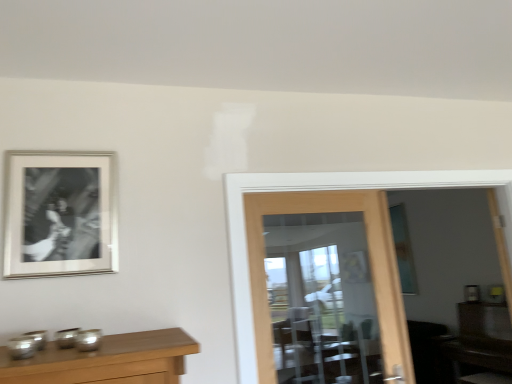
Question: Considering the relative positions of silver/metallic photo frame at upper left and clear glass door at center in the image provided, is silver/metallic photo frame at upper left to the right of clear glass door at center from the viewer's perspective?

Choices:
 (A) no
 (B) yes

Answer: (A)

Question: Is silver/metallic photo frame at upper left positioned beyond the bounds of clear glass door at center?

Choices:
 (A) no
 (B) yes

Answer: (B)

Question: Is silver/metallic photo frame at upper left to the left of clear glass door at center from the viewer's perspective?

Choices:
 (A) no
 (B) yes

Answer: (B)

Question: Does silver/metallic photo frame at upper left have a lesser width compared to clear glass door at center?

Choices:
 (A) no
 (B) yes

Answer: (B)

Question: Is silver/metallic photo frame at upper left bigger than clear glass door at center?

Choices:
 (A) yes
 (B) no

Answer: (B)

Question: Is brown wooden dresser at lower right spatially inside clear glass door at center, or outside of it?

Choices:
 (A) outside
 (B) inside

Answer: (A)

Question: In terms of height, does brown wooden dresser at lower right look taller or shorter compared to clear glass door at center?

Choices:
 (A) short
 (B) tall

Answer: (A)

Question: Considering their positions, is brown wooden dresser at lower right located in front of or behind clear glass door at center?

Choices:
 (A) behind
 (B) front

Answer: (A)

Question: In terms of size, does brown wooden dresser at lower right appear bigger or smaller than clear glass door at center?

Choices:
 (A) small
 (B) big

Answer: (B)

Question: Would you say clear glass door at center is to the left or to the right of brown wooden dresser at lower right in the picture?

Choices:
 (A) left
 (B) right

Answer: (A)

Question: Based on their sizes in the image, would you say clear glass door at center is bigger or smaller than brown wooden dresser at lower right?

Choices:
 (A) big
 (B) small

Answer: (B)

Question: Relative to brown wooden dresser at lower right, is clear glass door at center in front or behind?

Choices:
 (A) front
 (B) behind

Answer: (A)

Question: Is clear glass door at center taller or shorter than brown wooden dresser at lower right?

Choices:
 (A) tall
 (B) short

Answer: (A)

Question: From the image's perspective, is brown wooden dresser at lower right above or below silver/metallic photo frame at upper left?

Choices:
 (A) above
 (B) below

Answer: (B)

Question: In the image, is brown wooden dresser at lower right on the left side or the right side of silver/metallic photo frame at upper left?

Choices:
 (A) right
 (B) left

Answer: (A)